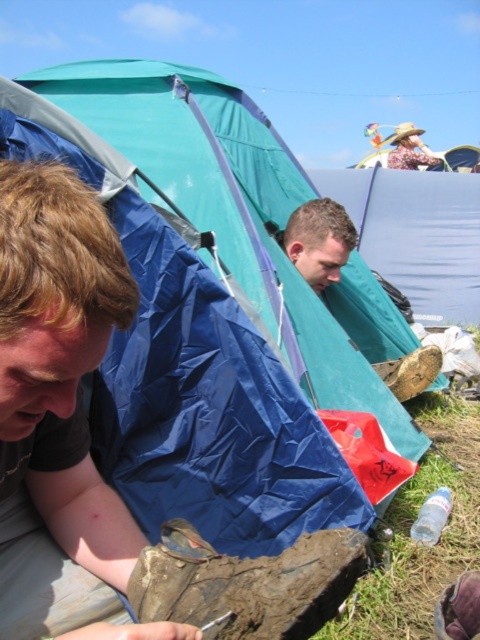
You are a hiker who just arrived at the campsite and need to locate your brown matte shoe at lower left. According to the coordinates provided, where should you look to find it?

The brown matte shoe at lower left is located at point (56, 396).

You are a hiker who needs to set up your tent. You see a brown matte shoe at lower left and a blue tarpaulin tent at left. Which object is positioned lower in the image?

The brown matte shoe at lower left is located below the blue tarpaulin tent at left, so the brown matte shoe at lower left is positioned lower in the image.